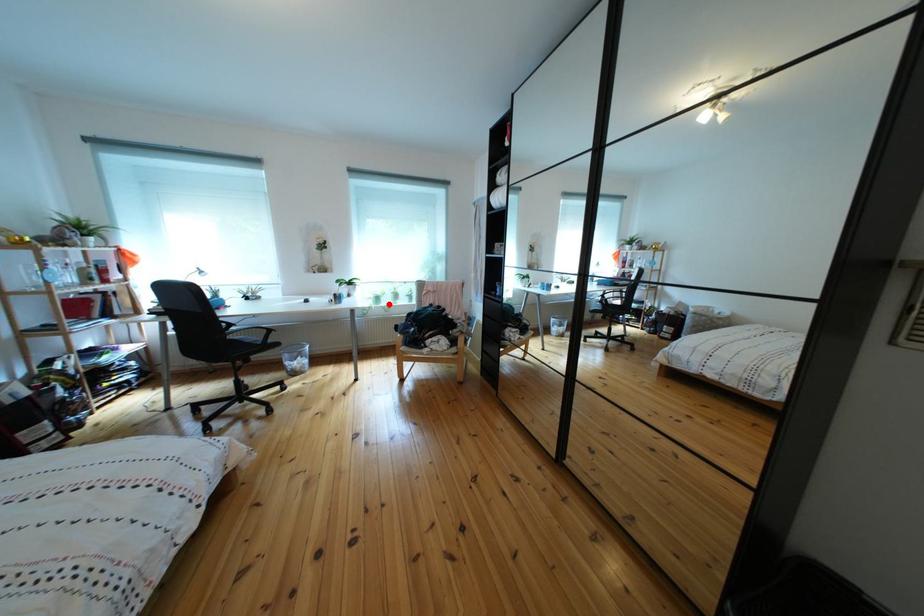
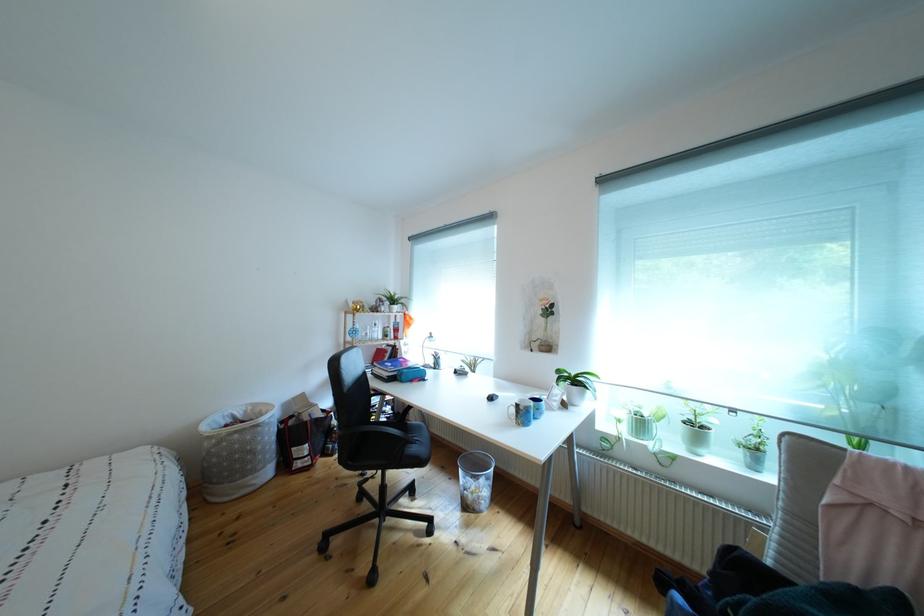
The point at the highlighted location is marked in the first image. Where is the corresponding point in the second image?

(652, 430)